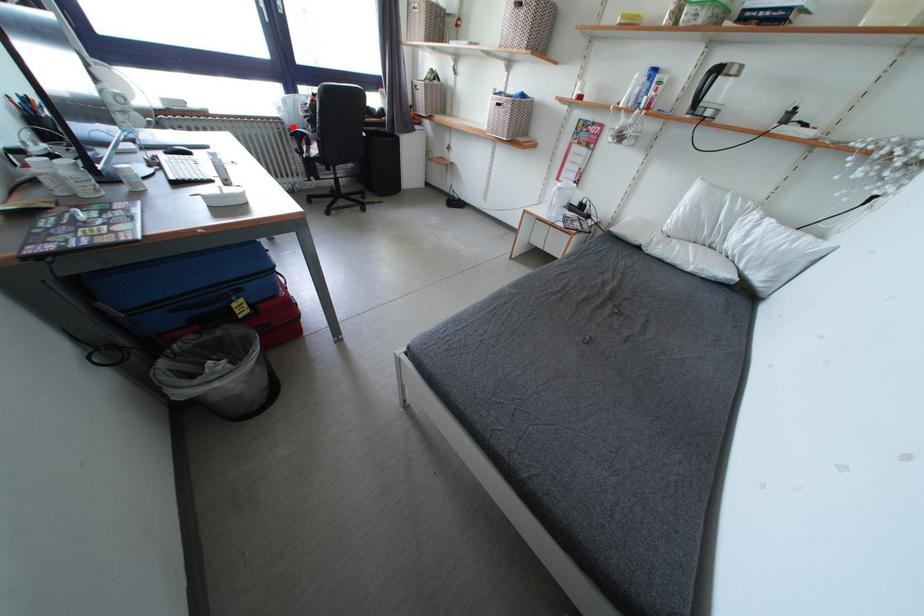
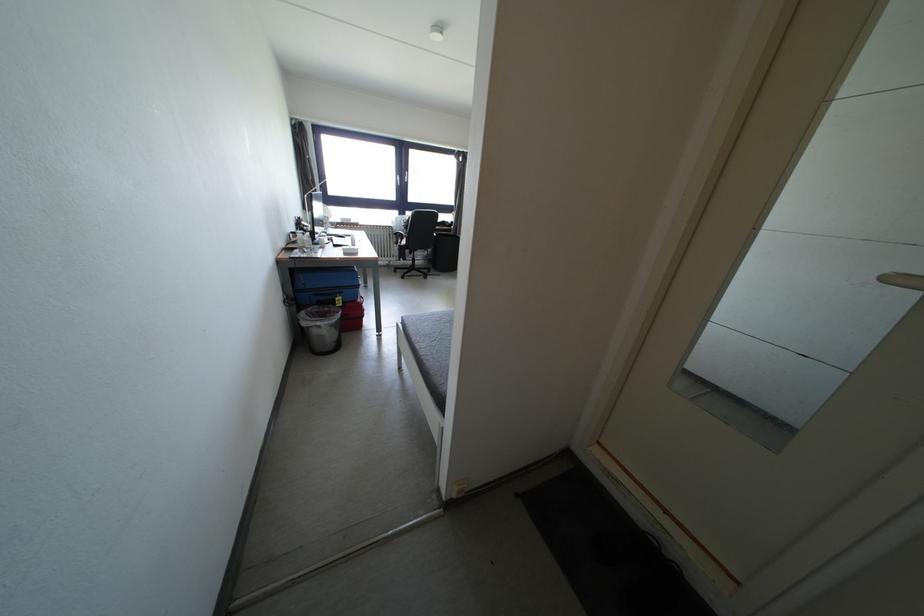
Question: I am providing you with two images of the same scene from different viewpoints. Given a red point in image1, look at the same physical point in image2. Is it:

Choices:
 (A) Closer to the viewpoint
 (B) Farther from the viewpoint

Answer: (A)